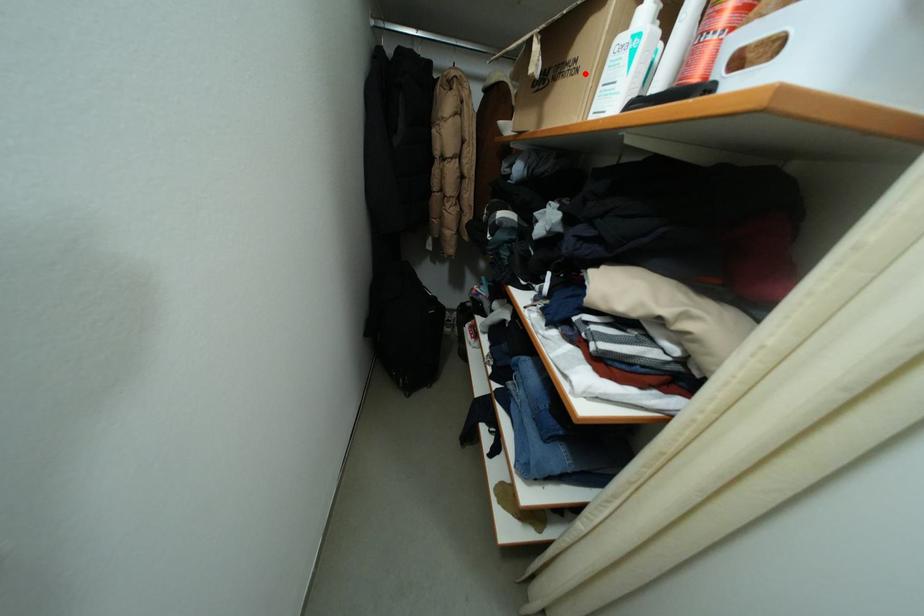
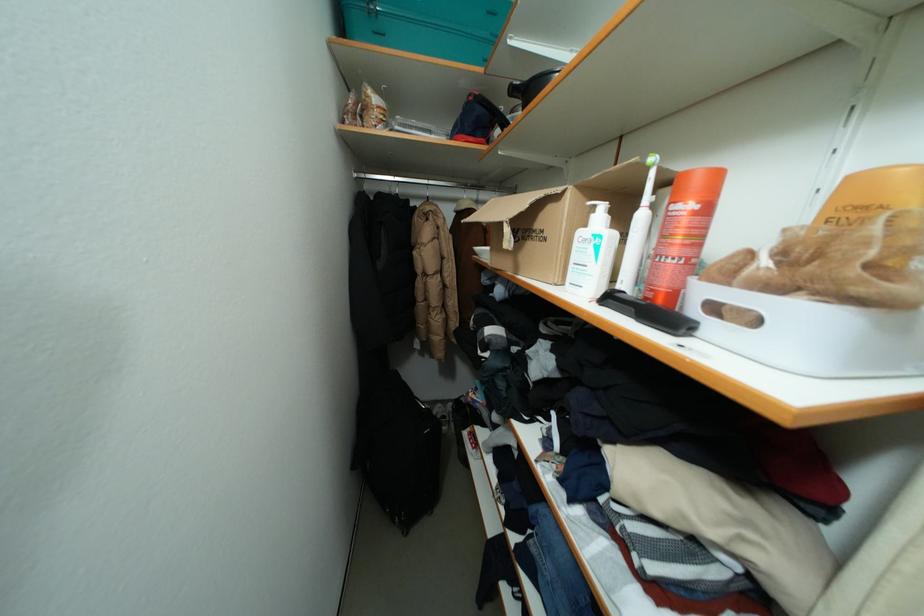
Where in the second image is the point corresponding to the highlighted location from the first image?

(553, 243)